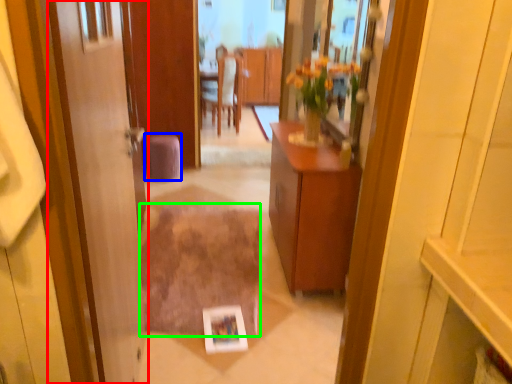
Question: Estimate the real-world distances between objects in this image. Which object is farther from door (highlighted by a red box), stool (highlighted by a blue box) or plain (highlighted by a green box)?

Choices:
 (A) stool
 (B) plain

Answer: (A)